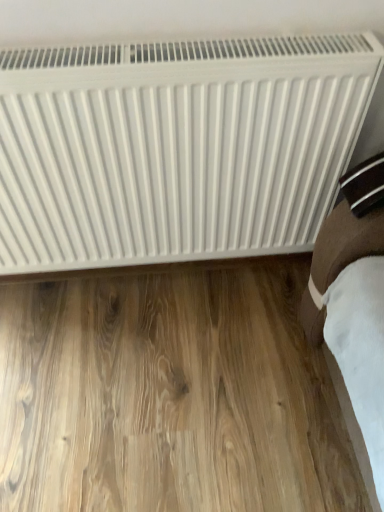
Measure the distance between white matte radiator at upper center and camera.

white matte radiator at upper center and camera are 31.01 inches apart from each other.

This screenshot has height=512, width=384. What do you see at coordinates (176, 147) in the screenshot? I see `white matte radiator at upper center` at bounding box center [176, 147].

You are a GUI agent. You are given a task and a screenshot of the screen. Output one action in this format:
    pyautogui.click(x=<x>, y=<y>)
    Task: Click on the white matte radiator at upper center
    
    Given the screenshot: What is the action you would take?
    (176, 147)

What is the approximate height of white matte radiator at upper center?

white matte radiator at upper center is 24.78 inches tall.

The height and width of the screenshot is (512, 384). I want to click on light brown wood flooring at lower center, so click(x=169, y=394).

Describe the element at coordinates (169, 394) in the screenshot. I see `light brown wood flooring at lower center` at that location.

The image size is (384, 512). Identify the location of white matte radiator at upper center. (176, 147).

Is light brown wood flooring at lower center at the right side of white matte radiator at upper center?

No, light brown wood flooring at lower center is not to the right of white matte radiator at upper center.

Who is more distant, light brown wood flooring at lower center or white matte radiator at upper center?

light brown wood flooring at lower center is further from the camera.

Considering the points (262, 352) and (150, 239), which point is in front, point (262, 352) or point (150, 239)?

The point (150, 239) is in front.

From the image's perspective, would you say light brown wood flooring at lower center is shown under white matte radiator at upper center?

Correct, light brown wood flooring at lower center appears lower than white matte radiator at upper center in the image.

From a real-world perspective, is light brown wood flooring at lower center below white matte radiator at upper center?

Yes, from a real-world perspective, light brown wood flooring at lower center is under white matte radiator at upper center.

Considering the sizes of light brown wood flooring at lower center and white matte radiator at upper center in the image, is light brown wood flooring at lower center wider or thinner than white matte radiator at upper center?

light brown wood flooring at lower center is wider than white matte radiator at upper center.

Does light brown wood flooring at lower center have a lesser height compared to white matte radiator at upper center?

Yes.

From the picture: Between light brown wood flooring at lower center and white matte radiator at upper center, which one has smaller size?

With smaller size is light brown wood flooring at lower center.

Choose the correct answer: Is light brown wood flooring at lower center inside white matte radiator at upper center or outside it?

light brown wood flooring at lower center is located beyond the bounds of white matte radiator at upper center.

Based on the photo, are light brown wood flooring at lower center and white matte radiator at upper center making contact?

light brown wood flooring at lower center and white matte radiator at upper center are not in contact.

Is light brown wood flooring at lower center turned away from white matte radiator at upper center?

No.

Locate an element on the screen. radiator lying above the light brown wood flooring at lower center (from the image's perspective) is located at coordinates (176, 147).

Can you confirm if white matte radiator at upper center is positioned to the left of light brown wood flooring at lower center?

No, white matte radiator at upper center is not to the left of light brown wood flooring at lower center.

Does white matte radiator at upper center come behind light brown wood flooring at lower center?

No, it is not.

Considering the positions of points (256, 47) and (168, 473), is point (256, 47) farther from camera compared to point (168, 473)?

No, it is not.

From the image's perspective, is white matte radiator at upper center positioned above or below light brown wood flooring at lower center?

white matte radiator at upper center is situated higher than light brown wood flooring at lower center in the image.

From a real-world perspective, is white matte radiator at upper center positioned above or below light brown wood flooring at lower center?

white matte radiator at upper center is situated higher than light brown wood flooring at lower center in the real world.

Considering the sizes of objects white matte radiator at upper center and light brown wood flooring at lower center in the image provided, who is thinner, white matte radiator at upper center or light brown wood flooring at lower center?

white matte radiator at upper center is thinner.

Can you confirm if white matte radiator at upper center is taller than light brown wood flooring at lower center?

Correct, white matte radiator at upper center is much taller as light brown wood flooring at lower center.

Who is smaller, white matte radiator at upper center or light brown wood flooring at lower center?

Smaller between the two is light brown wood flooring at lower center.

Would you say white matte radiator at upper center contains light brown wood flooring at lower center?

That's incorrect, light brown wood flooring at lower center is not inside white matte radiator at upper center.

Are white matte radiator at upper center and light brown wood flooring at lower center far apart?

That's not correct — white matte radiator at upper center is a little close to light brown wood flooring at lower center.

Is white matte radiator at upper center aimed at light brown wood flooring at lower center?

No.

How much distance is there between white matte radiator at upper center and light brown wood flooring at lower center?

white matte radiator at upper center and light brown wood flooring at lower center are 17.54 inches apart from each other.

What are the coordinates of `hardwood beneath the white matte radiator at upper center (from a real-world perspective)` in the screenshot? It's located at (169, 394).

Where is `radiator above the light brown wood flooring at lower center (from a real-world perspective)`? radiator above the light brown wood flooring at lower center (from a real-world perspective) is located at coordinates (176, 147).

You are a GUI agent. You are given a task and a screenshot of the screen. Output one action in this format:
    pyautogui.click(x=<x>, y=<y>)
    Task: Click on the radiator above the light brown wood flooring at lower center (from the image's perspective)
    The image size is (384, 512).
    Given the screenshot: What is the action you would take?
    pyautogui.click(x=176, y=147)